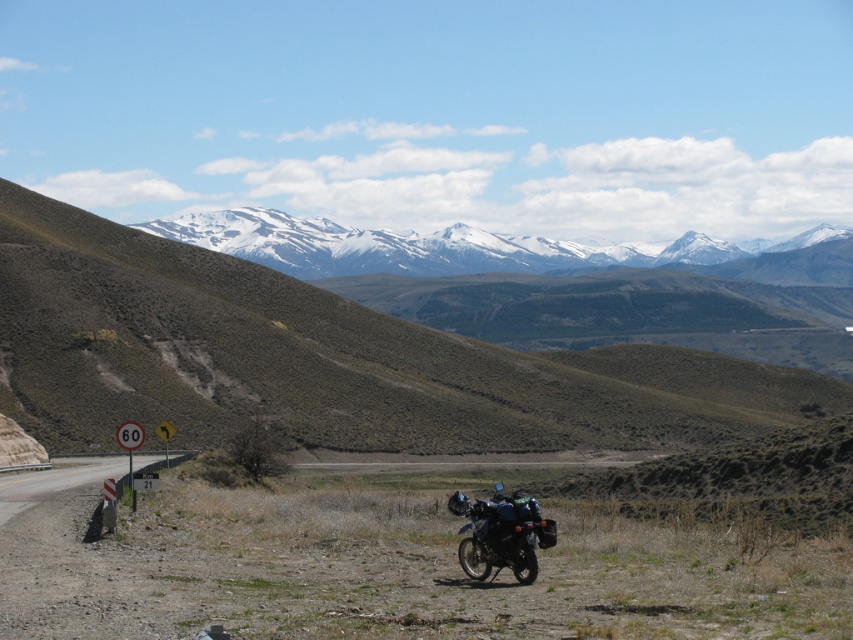
Question: Where is brushed metal signpost at left located in relation to metallic road sign at lower left in the image?

Choices:
 (A) left
 (B) right

Answer: (B)

Question: Does brushed metal signpost at left have a greater width compared to metallic dark green motorcycle at center?

Choices:
 (A) yes
 (B) no

Answer: (A)

Question: Among these objects, which one is nearest to the camera?

Choices:
 (A) brushed metal signpost at left
 (B) metallic dark green motorcycle at center
 (C) metallic road sign at lower left
 (D) brown/dry grassy hillside at upper center

Answer: (A)

Question: Which object is the farthest from the metallic dark green motorcycle at center?

Choices:
 (A) brushed metal signpost at left
 (B) metallic road sign at lower left
 (C) brown/dry grassy hillside at upper center
 (D) snowy granite mountain range at upper center

Answer: (D)

Question: Is brushed metal signpost at left in front of metallic dark green motorcycle at center?

Choices:
 (A) no
 (B) yes

Answer: (B)

Question: Which object appears farthest from the camera in this image?

Choices:
 (A) brushed metal signpost at left
 (B) metallic dark green motorcycle at center
 (C) snowy granite mountain range at upper center

Answer: (C)